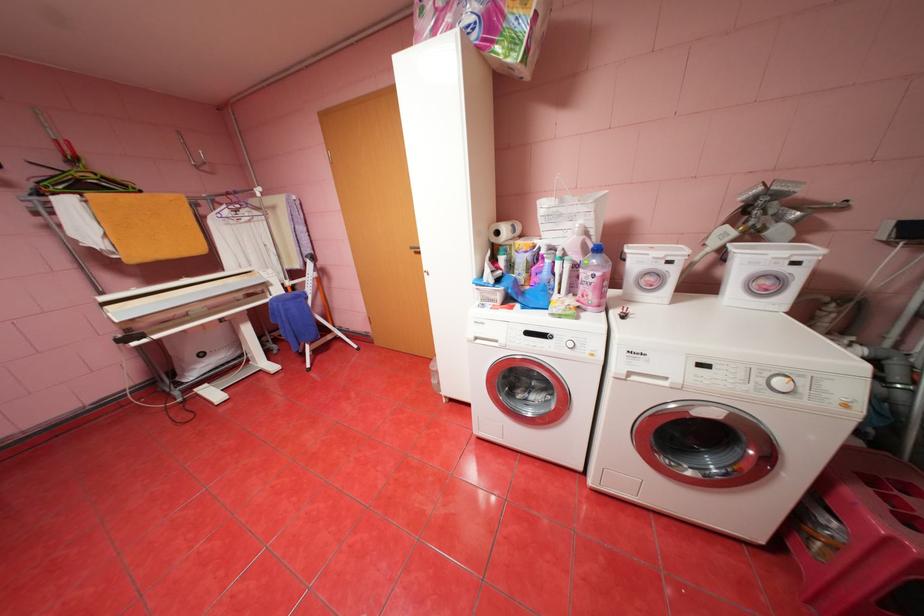
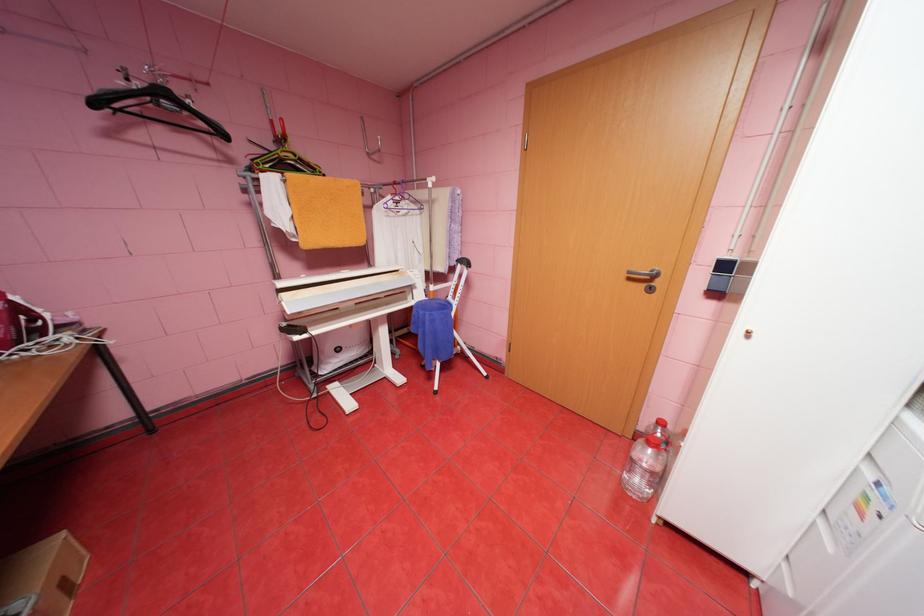
Question: How did the camera likely rotate?

Choices:
 (A) Left
 (B) Right
 (C) Up
 (D) Down

Answer: (A)